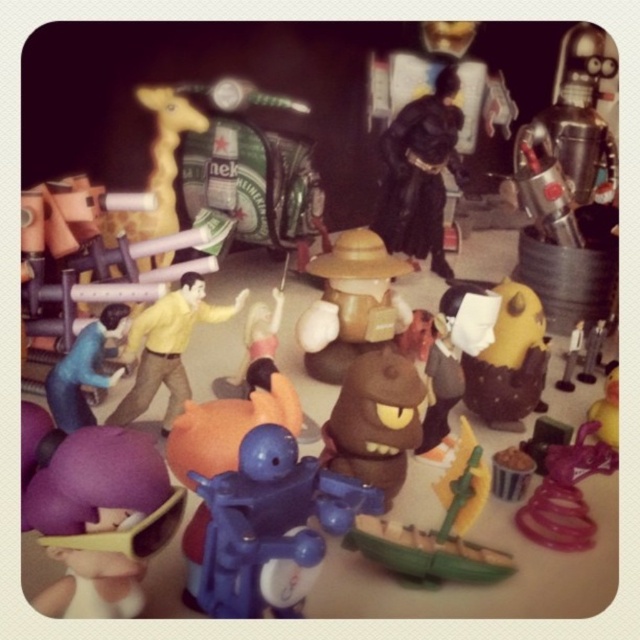
Between purple matte plush toy at lower left and brown matte figure at center, which one appears on the right side from the viewer's perspective?

Positioned to the right is brown matte figure at center.

Can you confirm if purple matte plush toy at lower left is positioned to the right of brown matte figure at center?

Incorrect, purple matte plush toy at lower left is not on the right side of brown matte figure at center.

Locate an element on the screen. This screenshot has height=640, width=640. purple matte plush toy at lower left is located at coordinates (100, 518).

Can you confirm if black matte figure at center is positioned to the left of blue matte figure at lower left?

In fact, black matte figure at center is to the right of blue matte figure at lower left.

Between point (384, 198) and point (81, 349), which one is positioned behind?

Positioned behind is point (384, 198).

Where is `black matte figure at center`? This screenshot has height=640, width=640. black matte figure at center is located at coordinates (420, 173).

Who is more distant from viewer, (125,460) or (458,563)?

The point (458,563) is behind.

The width and height of the screenshot is (640, 640). What do you see at coordinates (100, 518) in the screenshot?
I see `purple matte plush toy at lower left` at bounding box center [100, 518].

Where is `purple matte plush toy at lower left`? purple matte plush toy at lower left is located at coordinates (100, 518).